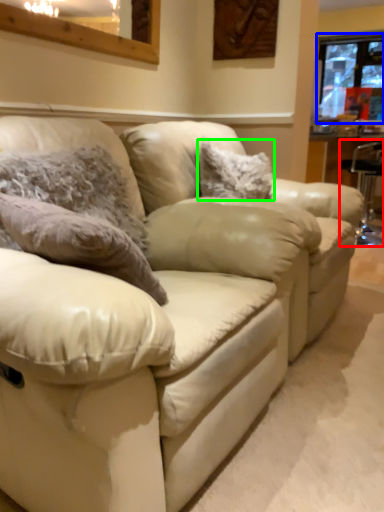
Question: Which object is positioned closest to bar stool (highlighted by a red box)? Select from window (highlighted by a blue box) and pillow (highlighted by a green box).

Choices:
 (A) window
 (B) pillow

Answer: (B)